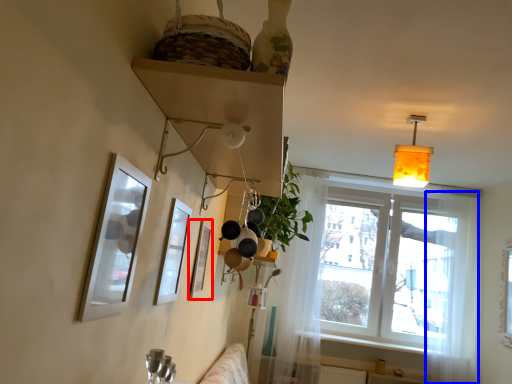
Question: Which point is closer to the camera, picture frame (highlighted by a red box) or curtain (highlighted by a blue box)?

Choices:
 (A) picture frame
 (B) curtain

Answer: (A)